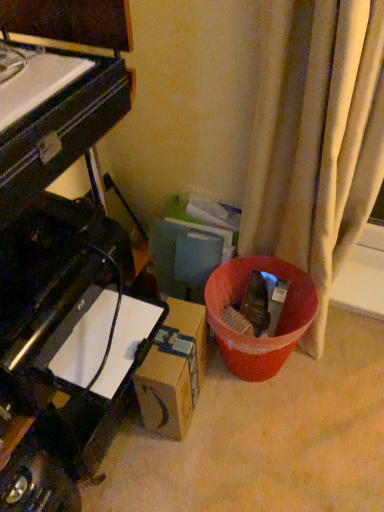
Image resolution: width=384 pixels, height=512 pixels. What do you see at coordinates (173, 373) in the screenshot?
I see `brown cardboard box at lower center` at bounding box center [173, 373].

You are a GUI agent. You are given a task and a screenshot of the screen. Output one action in this format:
    pyautogui.click(x=<x>, y=<y>)
    Task: Click on the brown cardboard box at lower center
    This screenshot has height=512, width=384.
    Given the screenshot: What is the action you would take?
    pyautogui.click(x=173, y=373)

Describe the element at coordinates (62, 253) in the screenshot. I see `black glossy piano at left` at that location.

Identify the location of black glossy piano at left. The height and width of the screenshot is (512, 384). tap(62, 253).

Find the location of a particular element. brown cardboard box at lower center is located at coordinates (173, 373).

Which object is positioned more to the left, brown cardboard box at lower center or black glossy piano at left?

From the viewer's perspective, black glossy piano at left appears more on the left side.

Which object is closer to the camera taking this photo, brown cardboard box at lower center or black glossy piano at left?

black glossy piano at left is in front.

Does point (148, 398) come farther from viewer compared to point (109, 372)?

Yes, point (148, 398) is behind point (109, 372).

From the image's perspective, is brown cardboard box at lower center on black glossy piano at left?

No, from the image's perspective, brown cardboard box at lower center is not over black glossy piano at left.

From a real-world perspective, which object stands above the other?

From a 3D spatial view, black glossy piano at left is above.

Can you confirm if brown cardboard box at lower center is wider than black glossy piano at left?

No, brown cardboard box at lower center is not wider than black glossy piano at left.

Who is taller, brown cardboard box at lower center or black glossy piano at left?

Standing taller between the two is brown cardboard box at lower center.

Who is smaller, brown cardboard box at lower center or black glossy piano at left?

Smaller between the two is brown cardboard box at lower center.

Is brown cardboard box at lower center inside or outside of black glossy piano at left?

The correct answer is: outside.

Is brown cardboard box at lower center with black glossy piano at left?

They are not placed beside each other.

Could you tell me if brown cardboard box at lower center is turned towards black glossy piano at left?

No, brown cardboard box at lower center is not facing towards black glossy piano at left.

Can you tell me how much brown cardboard box at lower center and black glossy piano at left differ in facing direction?

The angular difference between brown cardboard box at lower center and black glossy piano at left is 3.72 degrees.

Locate an element on the screen. The height and width of the screenshot is (512, 384). cardboard box below the black glossy piano at left (from a real-world perspective) is located at coordinates (173, 373).

In the scene shown: Between black glossy piano at left and brown cardboard box at lower center, which one appears on the left side from the viewer's perspective?

black glossy piano at left.

In the image, is black glossy piano at left positioned in front of or behind brown cardboard box at lower center?

Visually, black glossy piano at left is located in front of brown cardboard box at lower center.

Which point is more distant from viewer, (17, 32) or (195, 308)?

Positioned behind is point (195, 308).

From the image's perspective, would you say black glossy piano at left is positioned over brown cardboard box at lower center?

Yes.

From a real-world perspective, is black glossy piano at left located beneath brown cardboard box at lower center?

Incorrect, from a real-world perspective, black glossy piano at left is higher than brown cardboard box at lower center.

Does black glossy piano at left have a lesser width compared to brown cardboard box at lower center?

No, black glossy piano at left is not thinner than brown cardboard box at lower center.

Which of these two, black glossy piano at left or brown cardboard box at lower center, stands taller?

With more height is brown cardboard box at lower center.

Based on their sizes in the image, would you say black glossy piano at left is bigger or smaller than brown cardboard box at lower center?

black glossy piano at left is bigger than brown cardboard box at lower center.

Is black glossy piano at left positioned beyond the bounds of brown cardboard box at lower center?

black glossy piano at left is positioned outside brown cardboard box at lower center.

Is the surface of black glossy piano at left in direct contact with brown cardboard box at lower center?

black glossy piano at left and brown cardboard box at lower center are not in contact.

Could you tell me if black glossy piano at left is facing brown cardboard box at lower center?

No.

You are a GUI agent. You are given a task and a screenshot of the screen. Output one action in this format:
    pyautogui.click(x=<x>, y=<y>)
    Task: Click on the piano that is above the brown cardboard box at lower center (from a real-world perspective)
    
    Given the screenshot: What is the action you would take?
    pyautogui.click(x=62, y=253)

Locate an element on the screen. cardboard box that is on the right side of black glossy piano at left is located at coordinates (173, 373).

Identify the location of piano on the left of brown cardboard box at lower center. Image resolution: width=384 pixels, height=512 pixels. (62, 253).